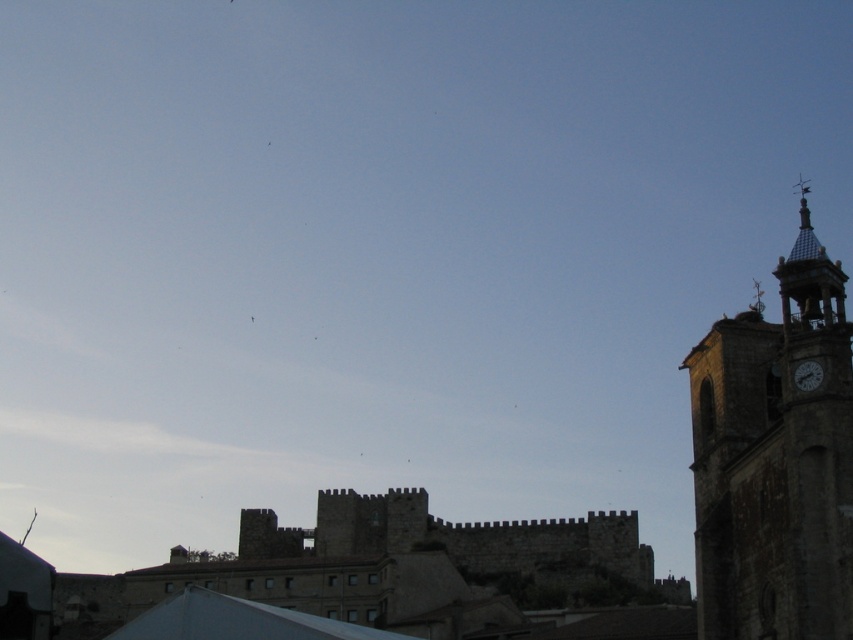
Can you confirm if dark stone clock tower at right is wider than matte gray clock at right?

Yes, dark stone clock tower at right is wider than matte gray clock at right.

Between dark stone clock tower at right and matte gray clock at right, which one appears on the right side from the viewer's perspective?

From the viewer's perspective, dark stone clock tower at right appears more on the right side.

Which is behind, point (738, 371) or point (809, 388)?

Positioned behind is point (738, 371).

This screenshot has height=640, width=853. Identify the location of dark stone clock tower at right. (775, 460).

Between point (761, 332) and point (189, 612), which one is positioned behind?

The point (761, 332) is more distant.

Can you confirm if dark stone clock tower at right is shorter than white fabric canopy at lower center?

No.

Does point (833, 371) lie behind point (144, 637)?

No, (833, 371) is closer to viewer.

This screenshot has height=640, width=853. Find the location of `dark stone clock tower at right`. dark stone clock tower at right is located at coordinates (775, 460).

Can you confirm if white fabric canopy at lower center is positioned to the left of matte gray clock at right?

Correct, you'll find white fabric canopy at lower center to the left of matte gray clock at right.

How distant is white fabric canopy at lower center from matte gray clock at right?

white fabric canopy at lower center and matte gray clock at right are 114.92 feet apart.

This screenshot has width=853, height=640. Identify the location of white fabric canopy at lower center. (236, 620).

Find the location of a particular element. white fabric canopy at lower center is located at coordinates (236, 620).